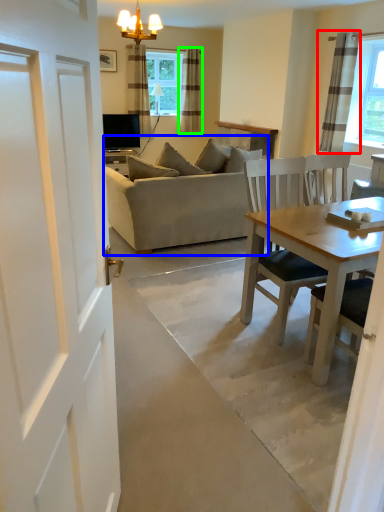
Question: Estimate the real-world distances between objects in this image. Which object is farther from curtain (highlighted by a red box), studio couch (highlighted by a blue box) or curtain (highlighted by a green box)?

Choices:
 (A) studio couch
 (B) curtain

Answer: (B)